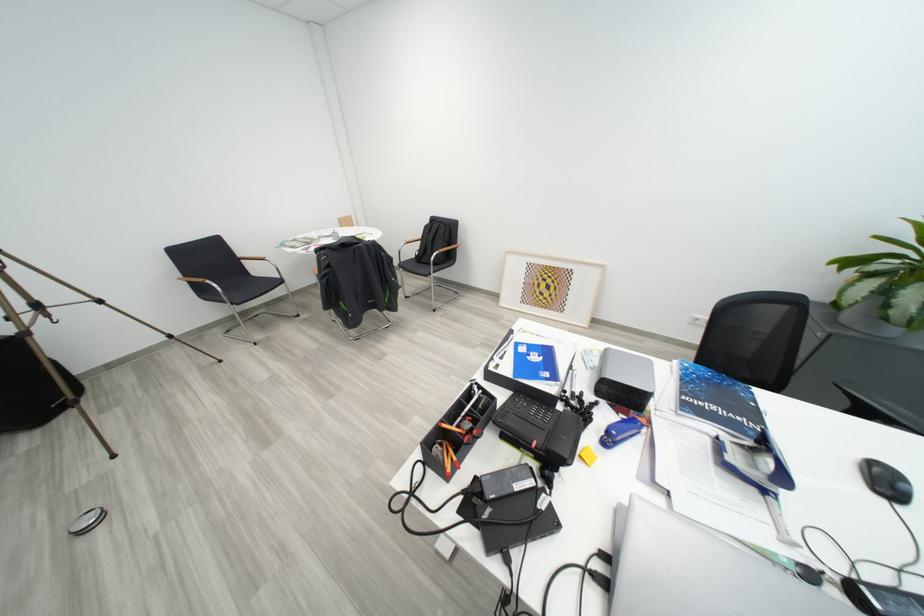
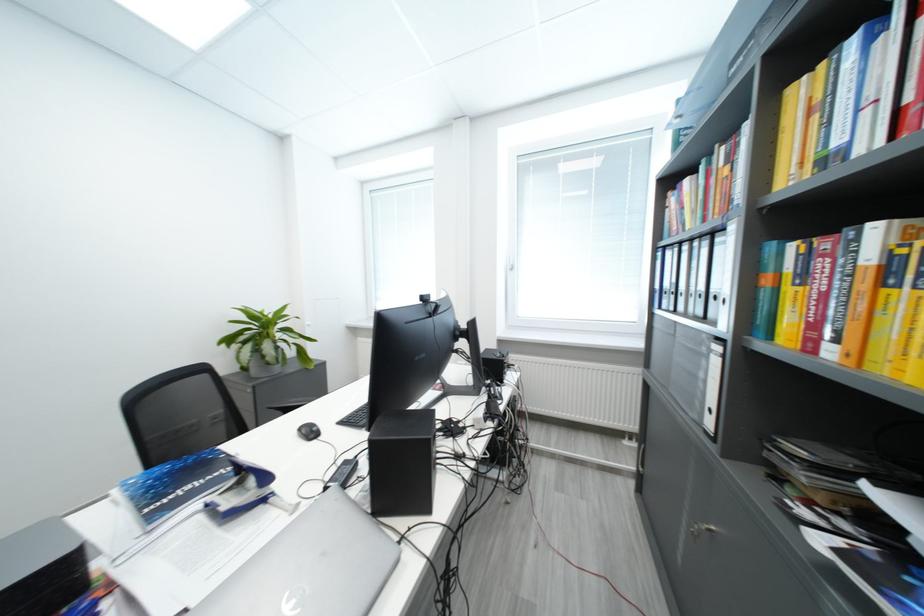
Locate, in the second image, the point that corresponds to (691,395) in the first image.

(152, 511)